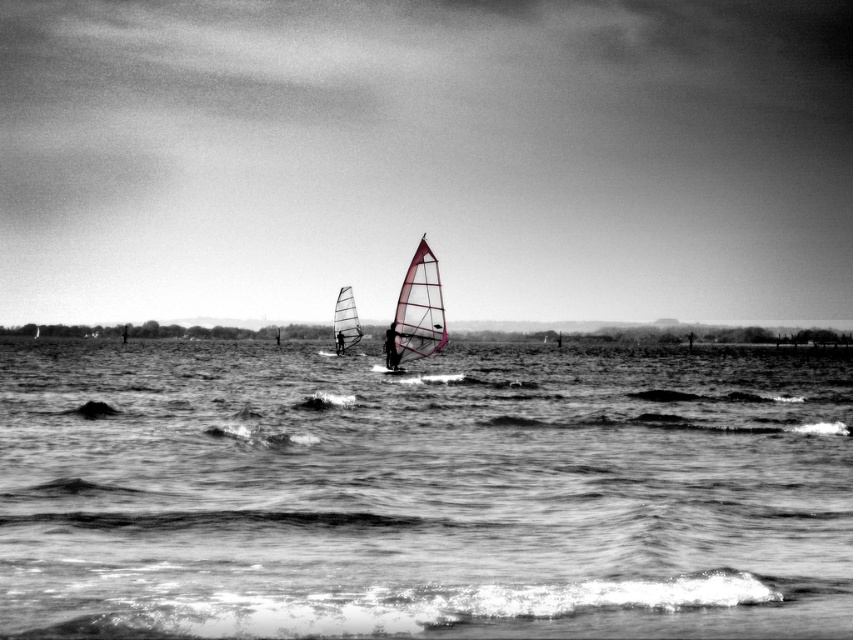
You are a photographer who wants to capture a closeup of the pink translucent sail at center and the matte pink sail at center. Which one would you need to adjust your camera focus to capture more clearly if you are currently focused on the one that is closer to you?

The pink translucent sail at center is taller than matte pink sail at center. Since the pink translucent sail at center is taller, it might be further away from you. To capture it more clearly, you should adjust your camera focus to the pink translucent sail at center.